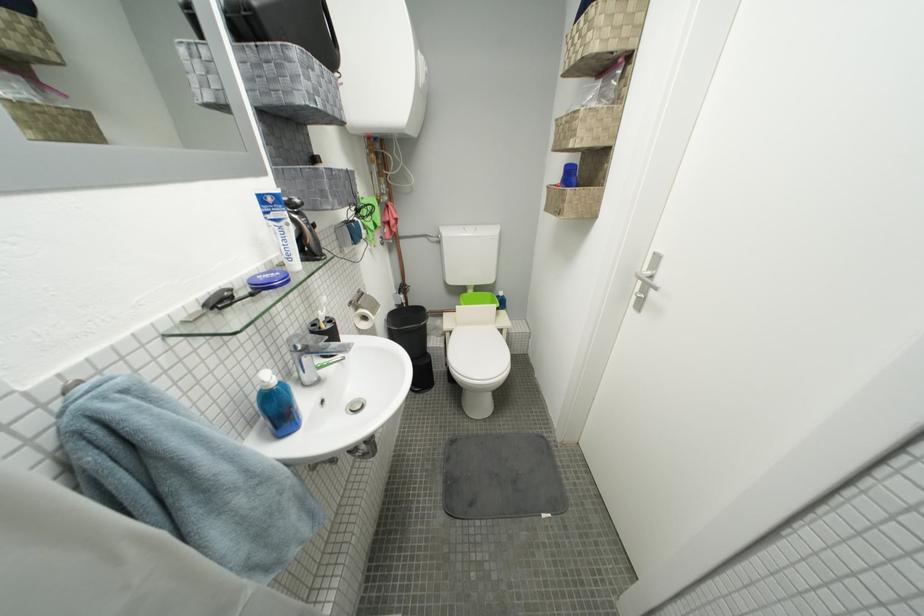
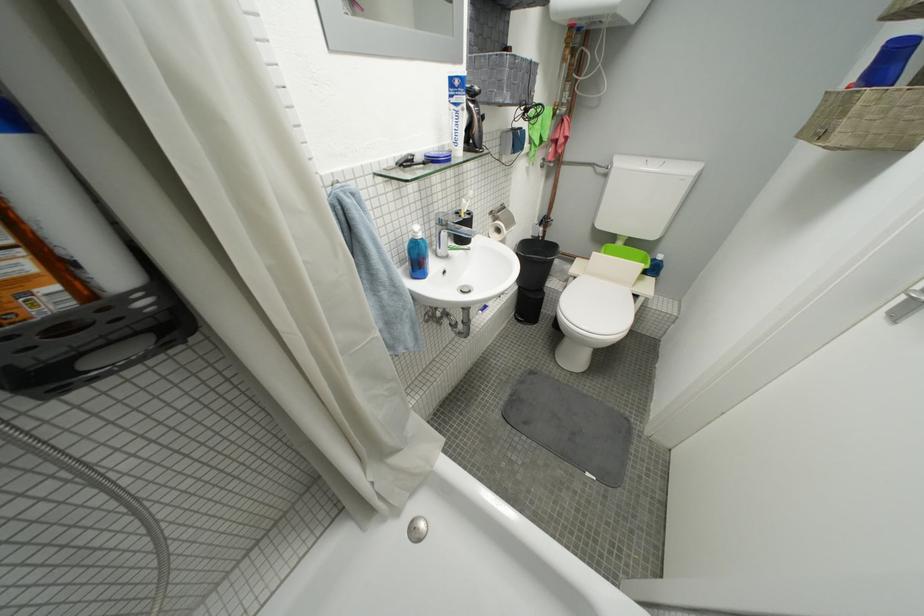
The point at (359, 306) is marked in the first image. Where is the corresponding point in the second image?

(500, 214)